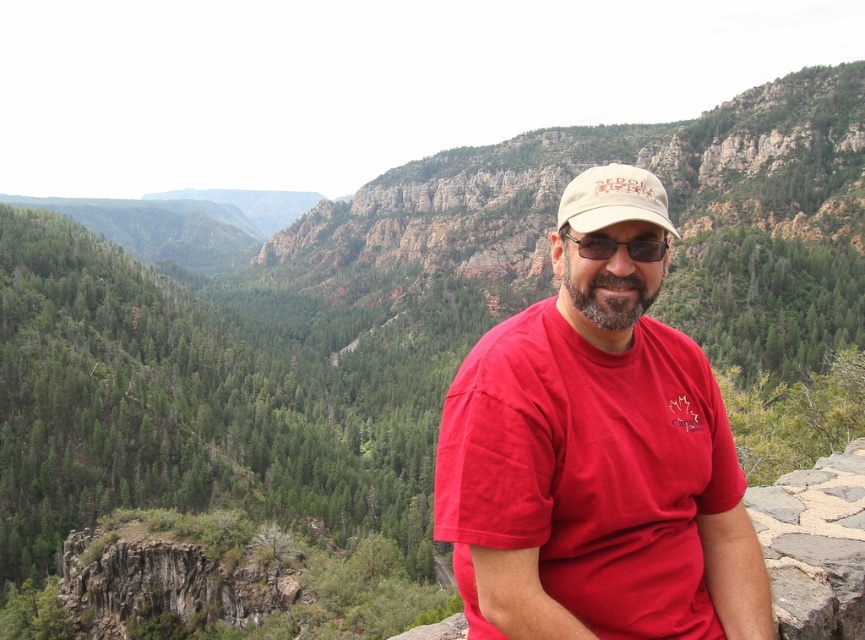
Question: Which is nearer to the matte red t-shirt at center?

Choices:
 (A) beige fabric cap at center
 (B) matte brown goggles at center

Answer: (B)

Question: Which of these objects is positioned closest to the matte brown goggles at center?

Choices:
 (A) matte red t-shirt at center
 (B) beige fabric cap at center

Answer: (A)

Question: Does beige fabric cap at center appear under matte brown goggles at center?

Choices:
 (A) no
 (B) yes

Answer: (A)

Question: Does beige fabric cap at center appear on the right side of matte brown goggles at center?

Choices:
 (A) yes
 (B) no

Answer: (A)

Question: Is beige fabric cap at center above matte brown goggles at center?

Choices:
 (A) yes
 (B) no

Answer: (A)

Question: Which of these objects is positioned farthest from the matte brown goggles at center?

Choices:
 (A) beige fabric cap at center
 (B) matte red t-shirt at center

Answer: (A)